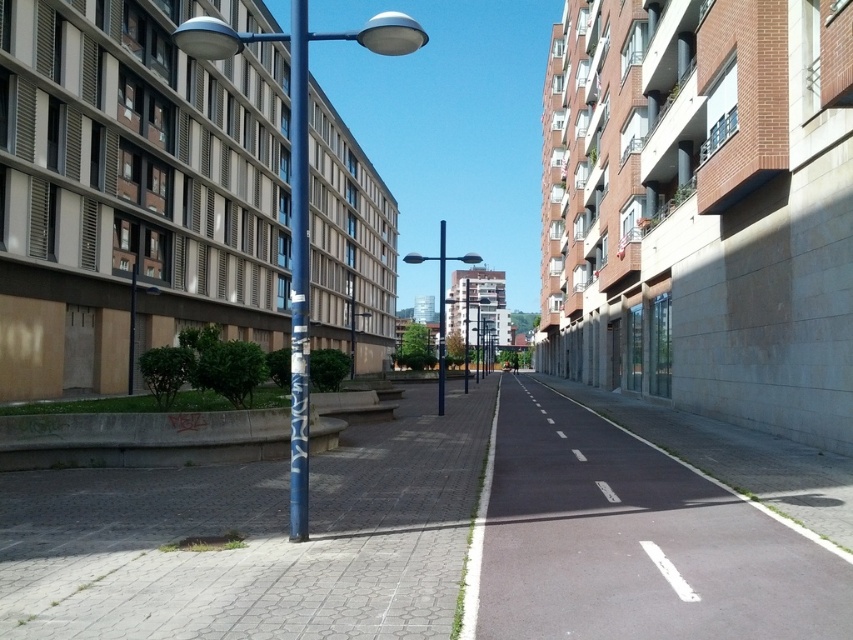
You are a delivery person trying to reach the bike lane on the right side of the street. You are currently standing on the gray brick pavement at lower left. Which direction should you move relative to the smooth blue pole at center to reach the bike lane?

The gray brick pavement at lower left is located below the smooth blue pole at center, so to reach the bike lane on the right, you should move upward from the gray brick pavement at lower left towards the smooth blue pole at center and then continue to the right side of the street.

Based on the photo, you are a cyclist planning to ride through the black asphalt bike lane at center and need to pass under the metallic pole at center. Will the bike lane allow you to pass under the pole without any issues?

The black asphalt bike lane at center is positioned under metallic pole at center, so the cyclist can pass under the pole without any issues as the bike lane is designed to accommodate passage beneath it.

You are a delivery person standing at the point marked as point (204, 608) in the image. You need to deliver a package to a location 6 meters away from your current position. Can you reach the destination without moving beyond the current scene shown in the image?

The distance between point (204, 608) and the viewer is 5.01 meters. Since the destination is 6 meters away, which is farther than the 5.01 meters available within the scene, you cannot reach the destination without moving beyond the current scene shown in the image.